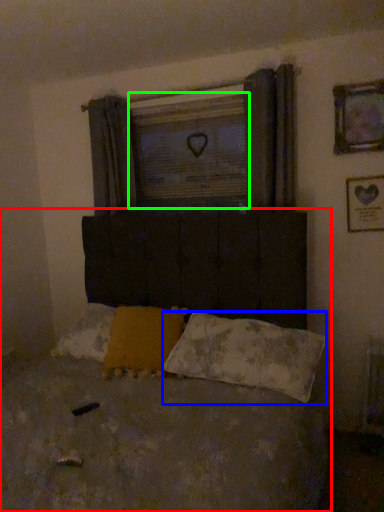
Question: Considering the real-world distances, which object is closest to bed (highlighted by a red box)? pillow (highlighted by a blue box) or window screen (highlighted by a green box).

Choices:
 (A) pillow
 (B) window screen

Answer: (A)